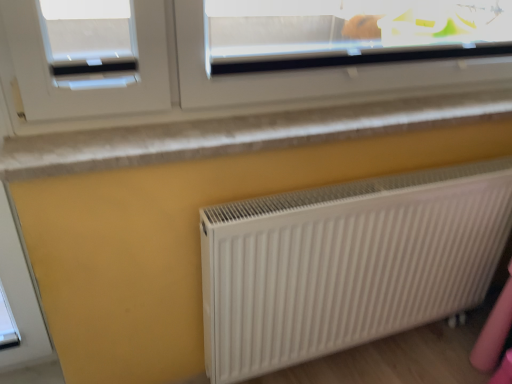
Where is `white ribbed radiator at lower right`? The width and height of the screenshot is (512, 384). white ribbed radiator at lower right is located at coordinates (347, 263).

The height and width of the screenshot is (384, 512). What do you see at coordinates (347, 263) in the screenshot?
I see `white ribbed radiator at lower right` at bounding box center [347, 263].

Measure the distance between white ribbed radiator at lower right and camera.

They are 3.41 feet apart.

Identify the location of white textured window sill at upper center. (238, 134).

The image size is (512, 384). What do you see at coordinates (238, 134) in the screenshot?
I see `white textured window sill at upper center` at bounding box center [238, 134].

In order to face white textured window sill at upper center, should I rotate leftwards or rightwards?

To face it directly, rotate right by 9.430 degrees.

Image resolution: width=512 pixels, height=384 pixels. Identify the location of white ribbed radiator at lower right. (347, 263).

Is white ribbed radiator at lower right to the left of white textured window sill at upper center from the viewer's perspective?

Incorrect, white ribbed radiator at lower right is not on the left side of white textured window sill at upper center.

Considering the positions of objects white ribbed radiator at lower right and white textured window sill at upper center in the image provided, who is behind, white ribbed radiator at lower right or white textured window sill at upper center?

Positioned behind is white ribbed radiator at lower right.

Which point is more distant from viewer, (321,260) or (75,169)?

Point (321,260)

From the image's perspective, is white ribbed radiator at lower right beneath white textured window sill at upper center?

Yes, from the image's perspective, white ribbed radiator at lower right is below white textured window sill at upper center.

From a real-world perspective, which object rests below the other?

white ribbed radiator at lower right, from a real-world perspective.

In terms of width, does white ribbed radiator at lower right look wider or thinner when compared to white textured window sill at upper center?

Considering their sizes, white ribbed radiator at lower right looks slimmer than white textured window sill at upper center.

Can you confirm if white ribbed radiator at lower right is shorter than white textured window sill at upper center?

In fact, white ribbed radiator at lower right may be taller than white textured window sill at upper center.

Is white ribbed radiator at lower right bigger than white textured window sill at upper center?

Correct, white ribbed radiator at lower right is larger in size than white textured window sill at upper center.

Is white ribbed radiator at lower right positioned beyond the bounds of white textured window sill at upper center?

Yes, white ribbed radiator at lower right is outside of white textured window sill at upper center.

Is white ribbed radiator at lower right directly adjacent to white textured window sill at upper center?

No, white ribbed radiator at lower right is not in contact with white textured window sill at upper center.

Is white textured window sill at upper center at the back of white ribbed radiator at lower right?

No, white ribbed radiator at lower right's orientation is not away from white textured window sill at upper center.

How different are the orientations of white ribbed radiator at lower right and white textured window sill at upper center in degrees?

0.726 degrees separate the facing orientations of white ribbed radiator at lower right and white textured window sill at upper center.

How far apart are white ribbed radiator at lower right and white textured window sill at upper center?

The distance of white ribbed radiator at lower right from white textured window sill at upper center is 15.33 inches.

Where is `window sill on the left of white ribbed radiator at lower right`? window sill on the left of white ribbed radiator at lower right is located at coordinates (238, 134).

Is white textured window sill at upper center to the left of white ribbed radiator at lower right from the viewer's perspective?

Yes.

Between white textured window sill at upper center and white ribbed radiator at lower right, which one is positioned behind?

white ribbed radiator at lower right is further away from the camera.

Does point (9, 175) come in front of point (325, 315)?

That is True.

From the image's perspective, is white textured window sill at upper center below white ribbed radiator at lower right?

No.

From a real-world perspective, between white textured window sill at upper center and white ribbed radiator at lower right, who is vertically lower?

white ribbed radiator at lower right.

Looking at their sizes, would you say white textured window sill at upper center is wider or thinner than white ribbed radiator at lower right?

white textured window sill at upper center is wider than white ribbed radiator at lower right.

Considering the sizes of objects white textured window sill at upper center and white ribbed radiator at lower right in the image provided, who is shorter, white textured window sill at upper center or white ribbed radiator at lower right?

white textured window sill at upper center is shorter.

Is white textured window sill at upper center smaller than white ribbed radiator at lower right?

Yes.

Based on the photo, would you say white textured window sill at upper center is outside white ribbed radiator at lower right?

Absolutely, white textured window sill at upper center is external to white ribbed radiator at lower right.

Consider the image. Does white textured window sill at upper center touch white ribbed radiator at lower right?

No, white textured window sill at upper center is not next to white ribbed radiator at lower right.

Is white textured window sill at upper center looking in the opposite direction of white ribbed radiator at lower right?

white textured window sill at upper center does not have its back to white ribbed radiator at lower right.

How many degrees apart are the facing directions of white textured window sill at upper center and white ribbed radiator at lower right?

The angular difference between white textured window sill at upper center and white ribbed radiator at lower right is 0.726 degrees.

Find the location of `radiator behind the white textured window sill at upper center`. radiator behind the white textured window sill at upper center is located at coordinates (347, 263).

Identify the location of window sill above the white ribbed radiator at lower right (from a real-world perspective). The height and width of the screenshot is (384, 512). (238, 134).

At what (x,y) coordinates should I click in order to perform the action: click on window sill that is in front of the white ribbed radiator at lower right. Please return your answer as a coordinate pair (x, y). Looking at the image, I should click on (238, 134).